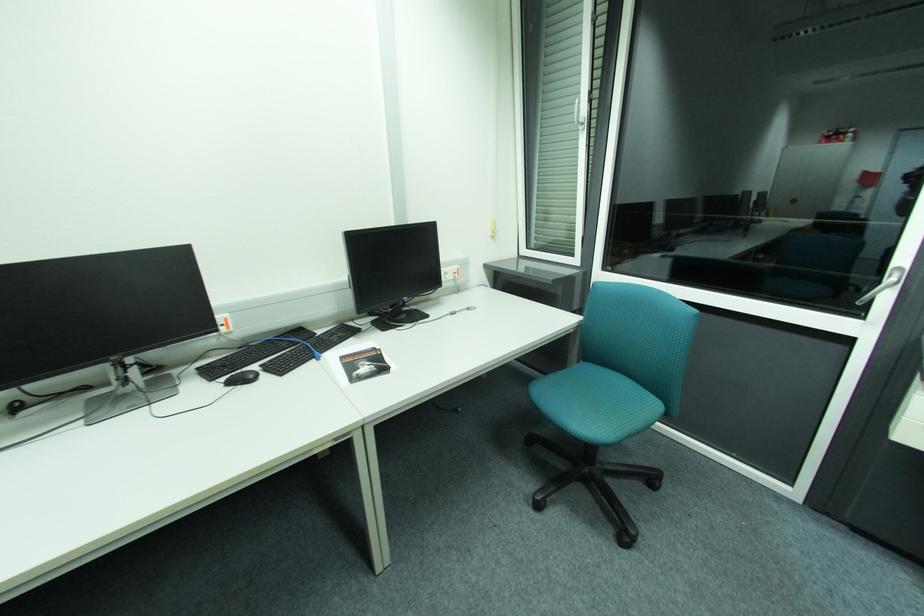
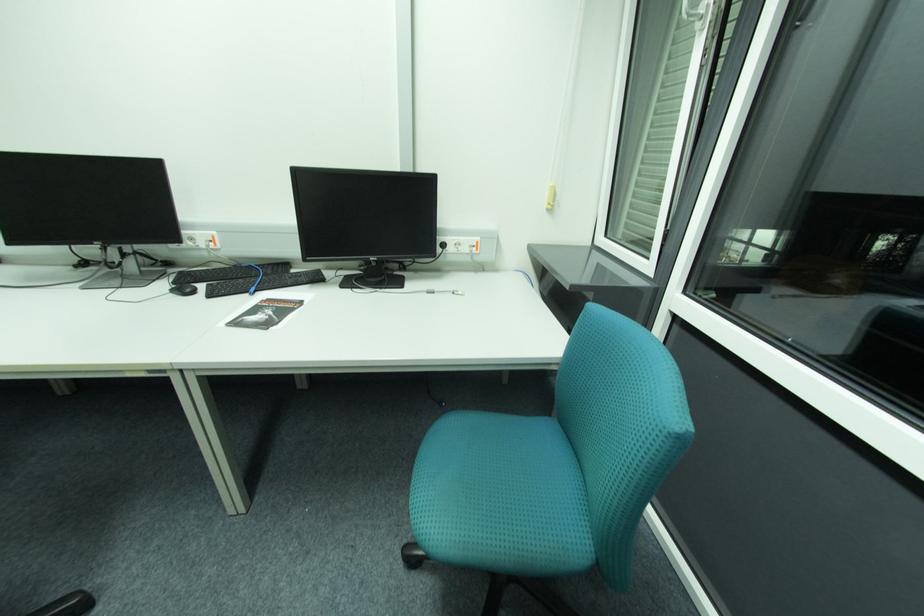
Locate, in the second image, the point that corresponds to (x=324, y=333) in the first image.

(298, 272)